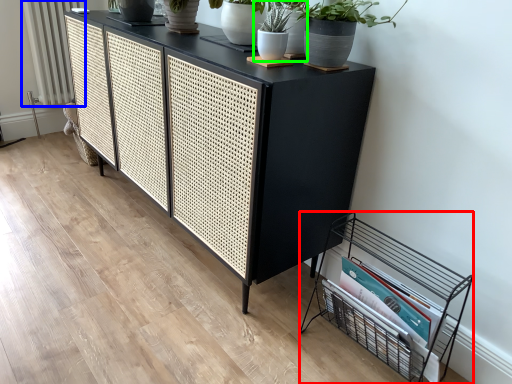
Question: Considering the real-world distances, which object is farthest from crate (highlighted by a red box)? radiator (highlighted by a blue box) or houseplant (highlighted by a green box)?

Choices:
 (A) radiator
 (B) houseplant

Answer: (A)